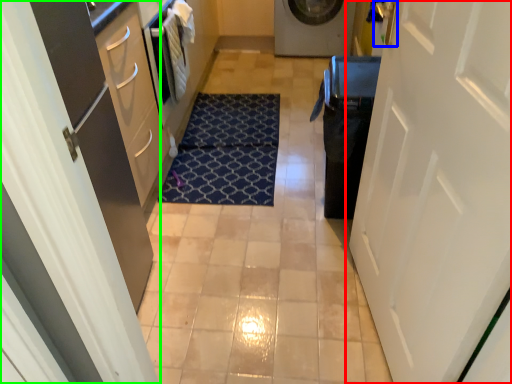
Question: Which is farther away from door (highlighted by a red box)? door handle (highlighted by a blue box) or door (highlighted by a green box)?

Choices:
 (A) door handle
 (B) door

Answer: (B)